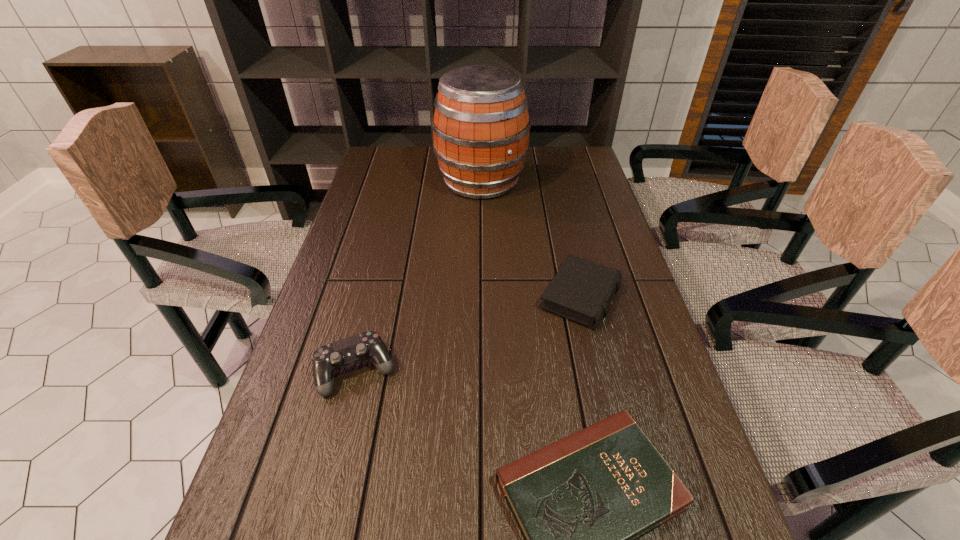
This screenshot has height=540, width=960. In order to click on the farthest object in this screenshot , I will do `click(481, 125)`.

I want to click on cider, so click(x=481, y=125).

Where is `the leftmost object`? The height and width of the screenshot is (540, 960). the leftmost object is located at coordinates (327, 359).

Identify the location of control. The width and height of the screenshot is (960, 540). (327, 359).

Identify the location of the taller Bible. (582, 290).

The image size is (960, 540). Identify the location of the farther Bible. (582, 290).

Identify the location of free space located 0.080m on the front of the cider. (481, 221).

I want to click on free location located on the front of the control, so click(323, 508).

Locate an element on the screen. The width and height of the screenshot is (960, 540). vacant space located 0.380m on the back of the second farthest object is located at coordinates (556, 192).

This screenshot has height=540, width=960. I want to click on object present at the far edge, so click(x=481, y=125).